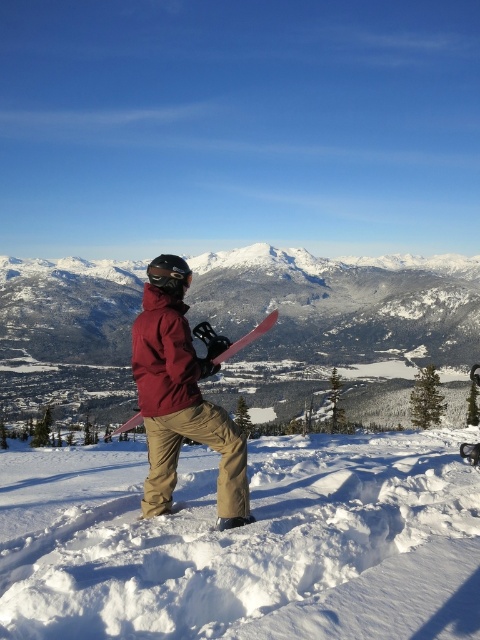
Can you confirm if snowy white mountain at center is bigger than matte red jacket at center?

Yes, snowy white mountain at center is bigger than matte red jacket at center.

Consider the image. Is snowy white mountain at center shorter than matte red jacket at center?

No.

Is point (299, 280) closer to viewer compared to point (223, 522)?

No, (299, 280) is behind (223, 522).

Identify the location of snowy white mountain at center. (342, 301).

Measure the distance between point (340, 276) and camera.

Point (340, 276) is 396.08 meters away from camera.

Is snowy white mountain at center wider than black matte goggles at center?

Indeed, snowy white mountain at center has a greater width compared to black matte goggles at center.

The height and width of the screenshot is (640, 480). What are the coordinates of `snowy white mountain at center` in the screenshot? It's located at (342, 301).

Between matte red jacket at center and pink matte snowboard at center, which one has more height?

pink matte snowboard at center is taller.

Who is more forward, (240, 438) or (123, 428)?

Point (240, 438)

The height and width of the screenshot is (640, 480). I want to click on matte red jacket at center, so click(181, 403).